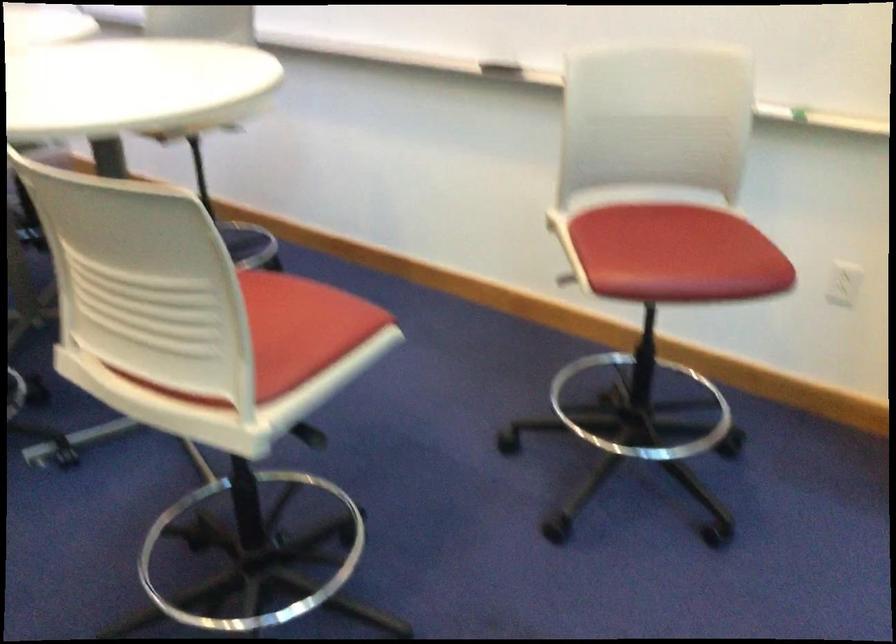
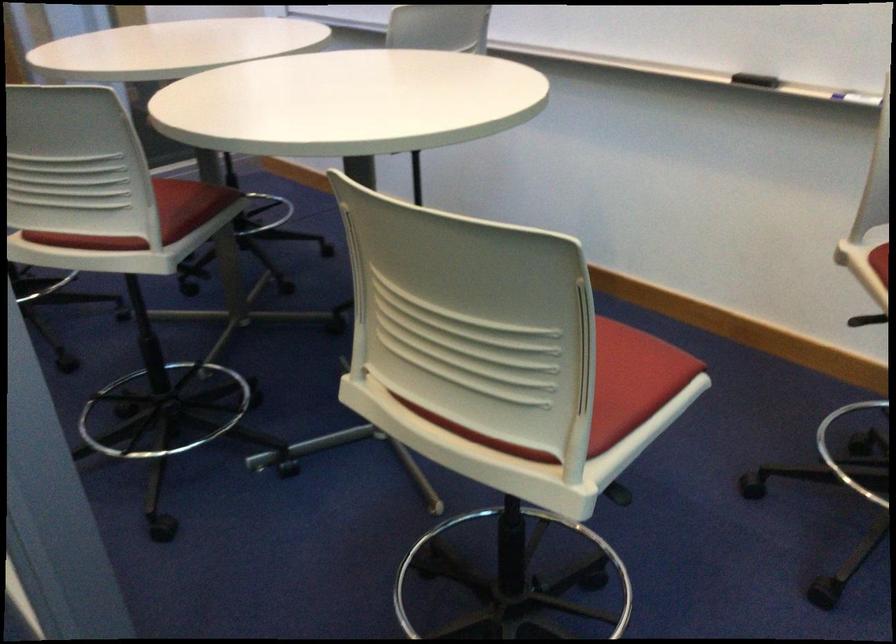
Where in the second image is the point corresponding to point (504, 67) from the first image?

(755, 80)